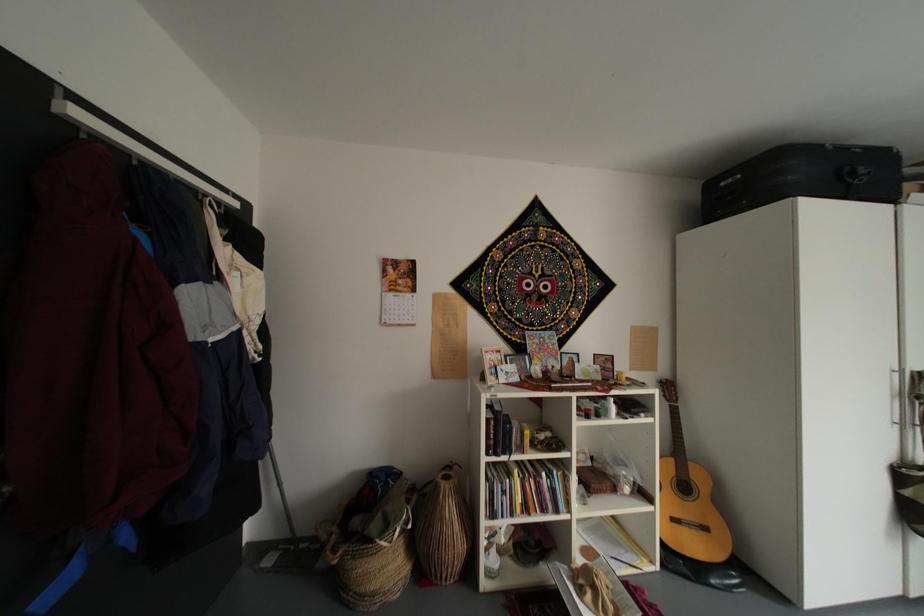
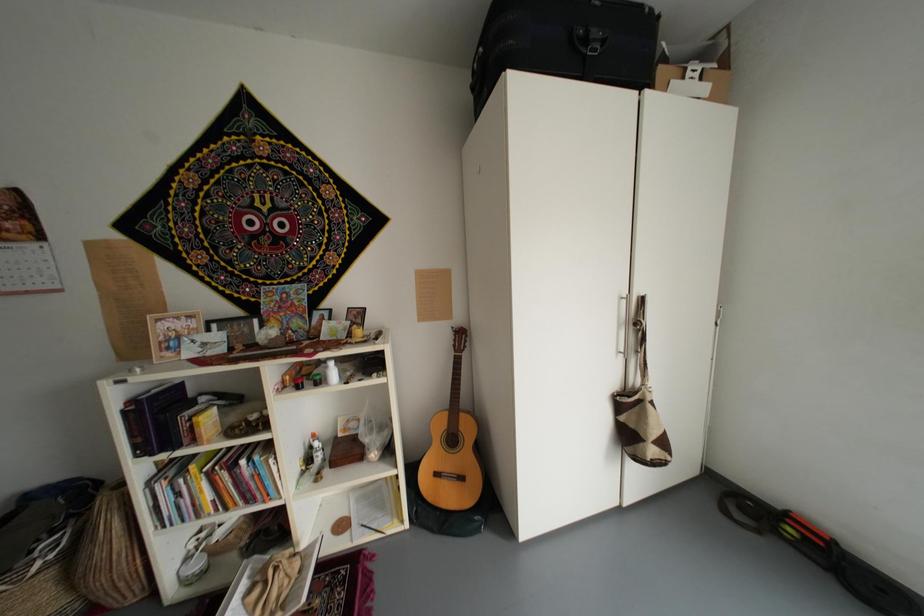
Question: Which direction would the cameraman need to move to produce the second image? Reply with the corresponding letter.

Choices:
 (A) Left
 (B) Right
 (C) Forward
 (D) Backward

Answer: (B)